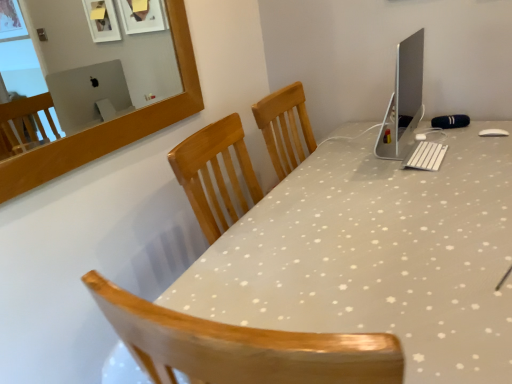
The image size is (512, 384). Find the location of `unoccupied region to the right of white plastic keyboard at center`. unoccupied region to the right of white plastic keyboard at center is located at coordinates (483, 149).